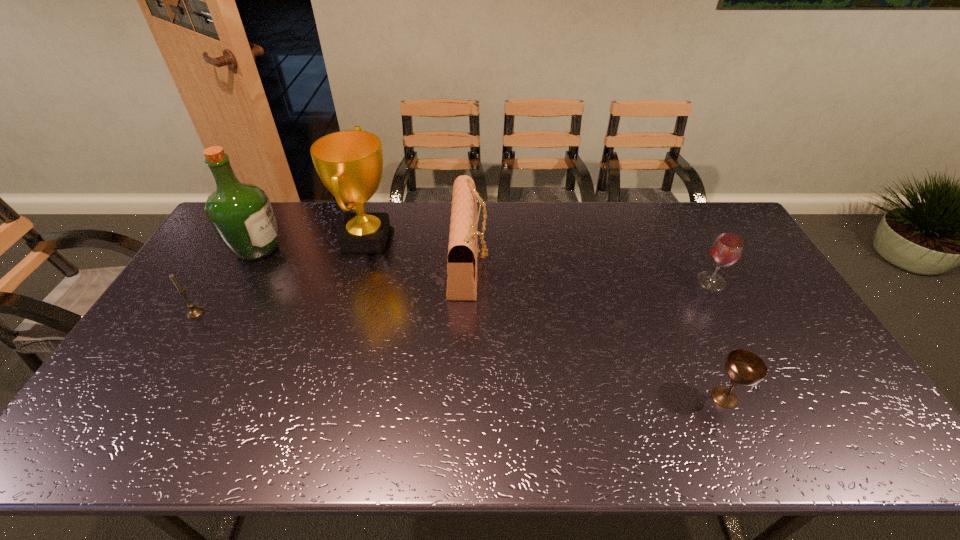
You are a GUI agent. You are given a task and a screenshot of the screen. Output one action in this format:
    pyautogui.click(x=<x>, y=<y>)
    Task: Click on the free location that satisfies the following two spatial constraints: 1. on the back side of the wineglass; 2. on the left side of the fifth farthest object
    
    Given the screenshot: What is the action you would take?
    pyautogui.click(x=215, y=281)

At what (x,y) coordinates should I click in order to perform the action: click on vacant area that satisfies the following two spatial constraints: 1. on the front-facing side of the liquor; 2. on the left side of the wineglass. Please return your answer as a coordinate pair (x, y). Looking at the image, I should click on (239, 281).

Image resolution: width=960 pixels, height=540 pixels. I want to click on free point that satisfies the following two spatial constraints: 1. on the back side of the rightmost object; 2. on the front-facing side of the award, so click(x=690, y=243).

The width and height of the screenshot is (960, 540). I want to click on free location that satisfies the following two spatial constraints: 1. on the back side of the nearest object; 2. on the front-facing side of the third object from left to right, so click(656, 243).